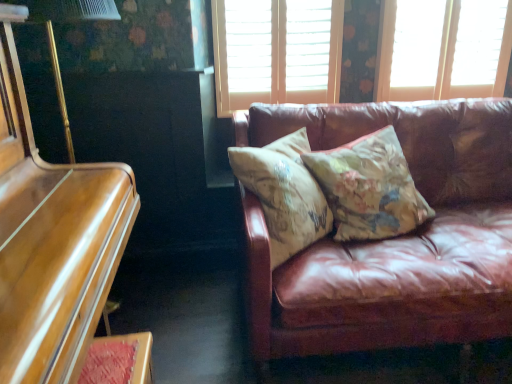
Question: Considering the relative positions of wooden blinds at upper center, acting as the 1th window starting from the left, and floral-patterned fabric pillow at center, which is the first pillow in left-to-right order, in the image provided, is wooden blinds at upper center, acting as the 1th window starting from the left, to the right of floral-patterned fabric pillow at center, which is the first pillow in left-to-right order, from the viewer's perspective?

Choices:
 (A) no
 (B) yes

Answer: (A)

Question: From the image's perspective, is wooden blinds at upper center, the 2th window viewed from the right, located beneath floral-patterned fabric pillow at center, the 2th pillow when ordered from right to left?

Choices:
 (A) yes
 (B) no

Answer: (B)

Question: Can you confirm if wooden blinds at upper center, the 2th window viewed from the right, is smaller than floral-patterned fabric pillow at center, the 2th pillow when ordered from right to left?

Choices:
 (A) yes
 (B) no

Answer: (A)

Question: Is wooden blinds at upper center, the 2th window viewed from the right, bigger than floral-patterned fabric pillow at center, the 2th pillow when ordered from right to left?

Choices:
 (A) no
 (B) yes

Answer: (A)

Question: Does wooden blinds at upper center, the 2th window viewed from the right, have a greater width compared to floral-patterned fabric pillow at center, the 2th pillow when ordered from right to left?

Choices:
 (A) no
 (B) yes

Answer: (A)

Question: Is wooden blinds at upper center, the 2th window viewed from the right, oriented away from floral-patterned fabric pillow at center, the 2th pillow when ordered from right to left?

Choices:
 (A) no
 (B) yes

Answer: (A)

Question: From the image's perspective, would you say shiny brown piano at left is positioned over wooden blinds at upper center, acting as the 1th window starting from the left?

Choices:
 (A) yes
 (B) no

Answer: (B)

Question: From the image's perspective, is shiny brown piano at left below wooden blinds at upper center, the 2th window viewed from the right?

Choices:
 (A) no
 (B) yes

Answer: (B)

Question: Does shiny brown piano at left have a greater width compared to wooden blinds at upper center, acting as the 1th window starting from the left?

Choices:
 (A) yes
 (B) no

Answer: (A)

Question: Can we say shiny brown piano at left lies outside wooden blinds at upper center, the 2th window viewed from the right?

Choices:
 (A) no
 (B) yes

Answer: (B)

Question: Is wooden blinds at upper center, the 2th window viewed from the right, at the back of shiny brown piano at left?

Choices:
 (A) yes
 (B) no

Answer: (B)

Question: From a real-world perspective, is shiny brown piano at left over wooden blinds at upper center, acting as the 1th window starting from the left?

Choices:
 (A) no
 (B) yes

Answer: (A)

Question: Considering the relative positions of matte white window at upper right, which is the 1th window in right-to-left order, and wooden blinds at upper center, the 2th window viewed from the right, in the image provided, is matte white window at upper right, which is the 1th window in right-to-left order, to the right of wooden blinds at upper center, the 2th window viewed from the right, from the viewer's perspective?

Choices:
 (A) no
 (B) yes

Answer: (B)